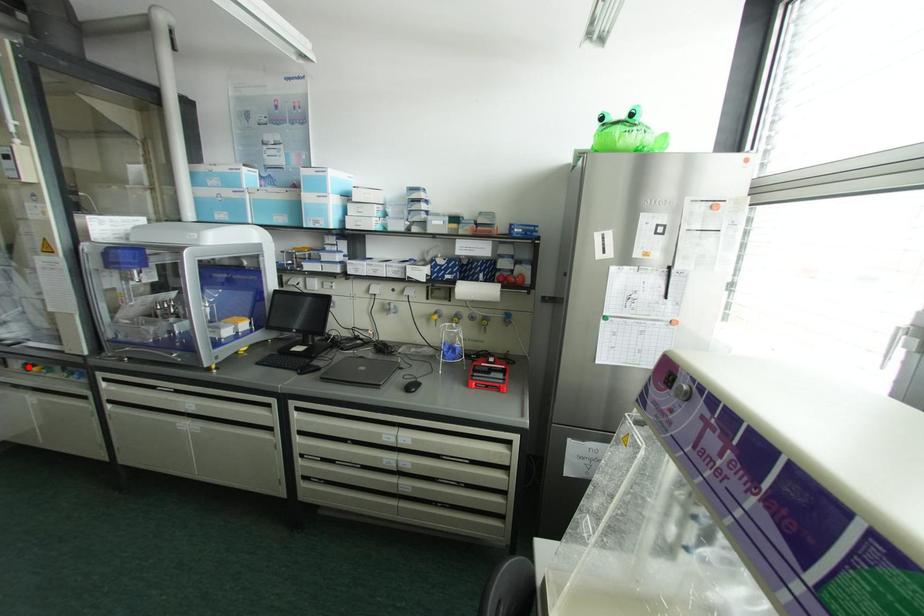
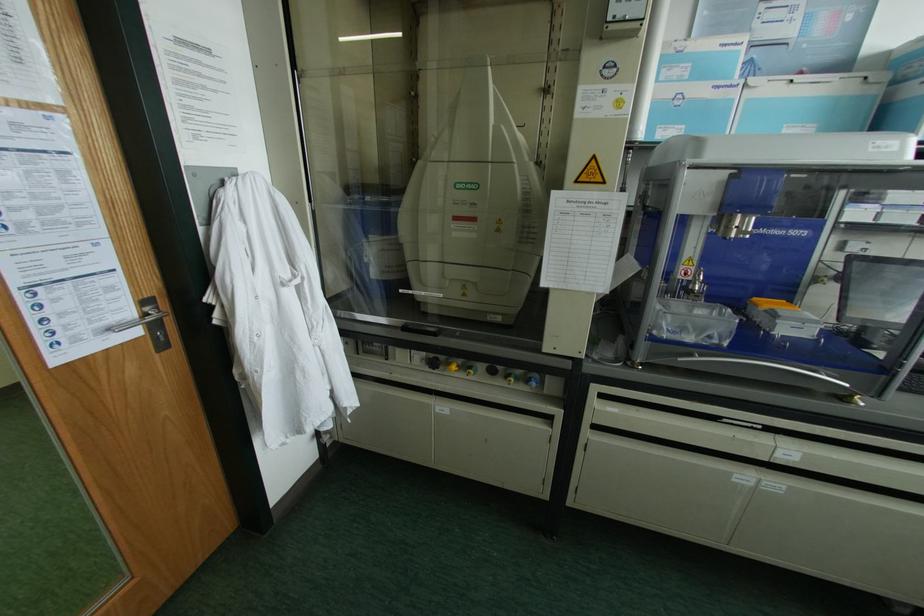
Where in the second image is the point corresponding to the highlighted location from the first image?

(432, 363)